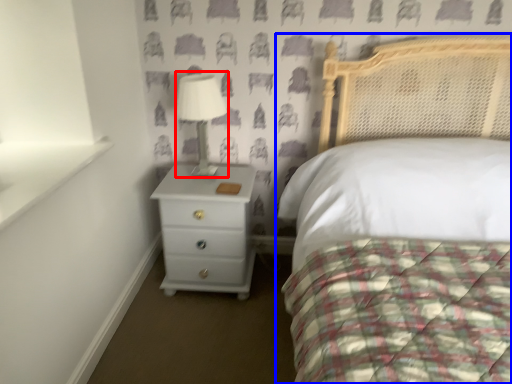
Question: Which object appears closest to the camera in this image, table lamp (highlighted by a red box) or bed (highlighted by a blue box)?

Choices:
 (A) table lamp
 (B) bed

Answer: (B)